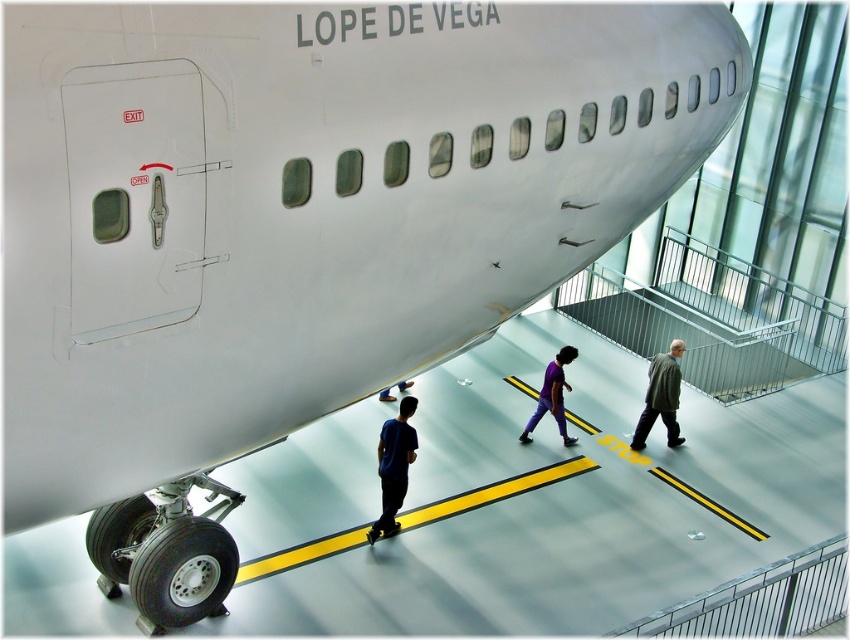
Question: In this image, where is blue fabric shirt at center located relative to purple matte shirt at center?

Choices:
 (A) left
 (B) right

Answer: (A)

Question: Which object is positioned closest to the purple matte shirt at center?

Choices:
 (A) green matte coat at center
 (B) blue fabric shirt at center

Answer: (A)

Question: Does blue fabric shirt at center appear under blue fabric pants at center?

Choices:
 (A) yes
 (B) no

Answer: (A)

Question: Which point is farther to the camera?

Choices:
 (A) (394, 468)
 (B) (398, 390)
 (C) (654, 413)

Answer: (B)

Question: Among these objects, which one is nearest to the camera?

Choices:
 (A) blue fabric shirt at center
 (B) green matte coat at center

Answer: (A)

Question: Is green matte coat at center further to the viewer compared to blue fabric pants at center?

Choices:
 (A) yes
 (B) no

Answer: (B)